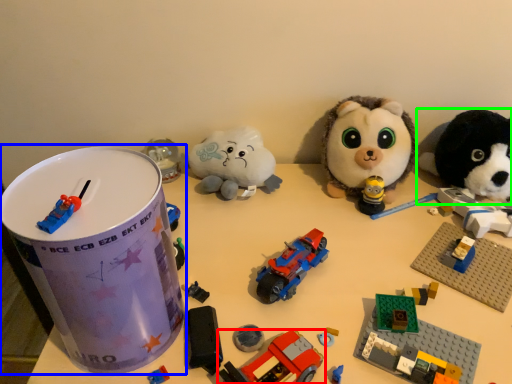
Question: Which is nearer to the toy (highlighted by a red box)? toy (highlighted by a blue box) or toy (highlighted by a green box).

Choices:
 (A) toy
 (B) toy

Answer: (A)